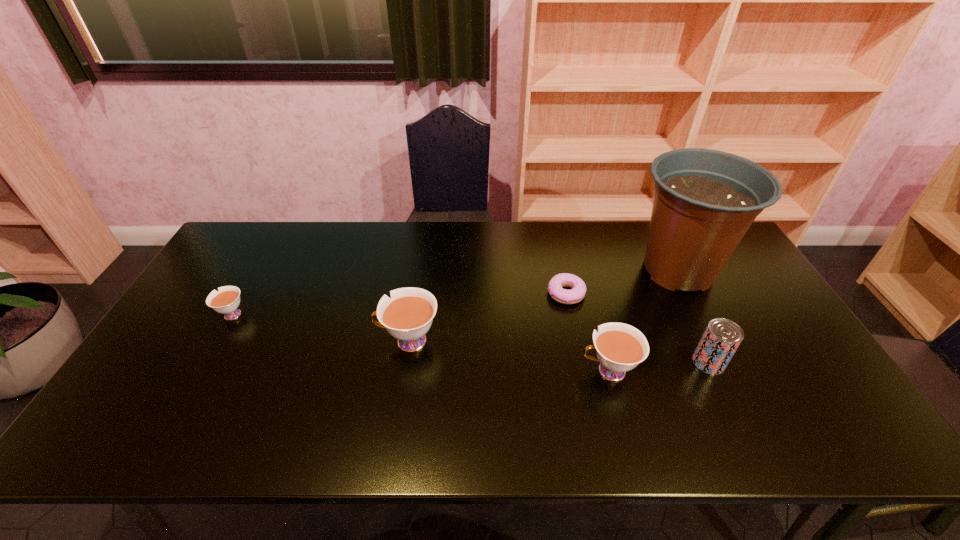
Find the location of a particular element. vacant space that is in between the leftmost object and the flowerpot is located at coordinates (454, 293).

At what (x,y) coordinates should I click in order to perform the action: click on object that is the fourth closest to the second teacup from left to right. Please return your answer as a coordinate pair (x, y). Looking at the image, I should click on (705, 200).

Point out which object is positioned as the second nearest to the fifth object from right to left. Please provide its 2D coordinates. Your answer should be formatted as a tuple, i.e. [(x, y)], where the tuple contains the x and y coordinates of a point satisfying the conditions above.

[(620, 347)]

Identify the location of teacup that stands as the third closest to the doughnut. This screenshot has height=540, width=960. (226, 301).

Identify which teacup is located as the nearest to the rightmost teacup. Please provide its 2D coordinates. Your answer should be formatted as a tuple, i.e. [(x, y)], where the tuple contains the x and y coordinates of a point satisfying the conditions above.

[(408, 315)]

This screenshot has height=540, width=960. In order to click on free point that satisfies the following two spatial constraints: 1. on the front side of the shortest object; 2. on the side of the second teacup from right to left with the handle in this screenshot , I will do `click(576, 341)`.

Locate an element on the screen. free space that satisfies the following two spatial constraints: 1. on the side of the beer can with the handle; 2. on the right side of the second teacup from left to right is located at coordinates (405, 362).

I want to click on free location that satisfies the following two spatial constraints: 1. on the front side of the doughnut; 2. on the side of the leftmost object with the handle, so click(x=570, y=315).

Find the location of a particular element. The image size is (960, 540). vacant region that satisfies the following two spatial constraints: 1. on the side of the second teacup from left to right with the handle; 2. on the right side of the beer can is located at coordinates (405, 362).

Find the location of `free space that satisfies the following two spatial constraints: 1. on the front side of the doughnut; 2. on the side of the shortest teacup with the handle`. free space that satisfies the following two spatial constraints: 1. on the front side of the doughnut; 2. on the side of the shortest teacup with the handle is located at coordinates (570, 315).